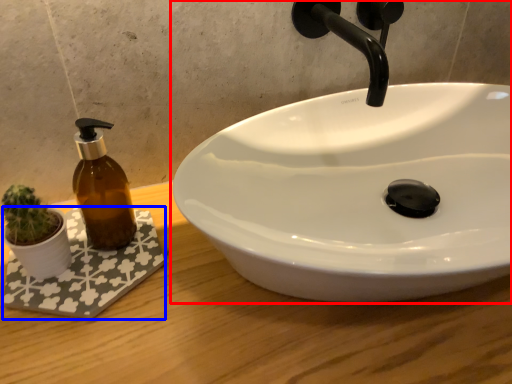
Question: Which point is closer to the camera, sink (highlighted by a red box) or bath mat (highlighted by a blue box)?

Choices:
 (A) sink
 (B) bath mat

Answer: (A)